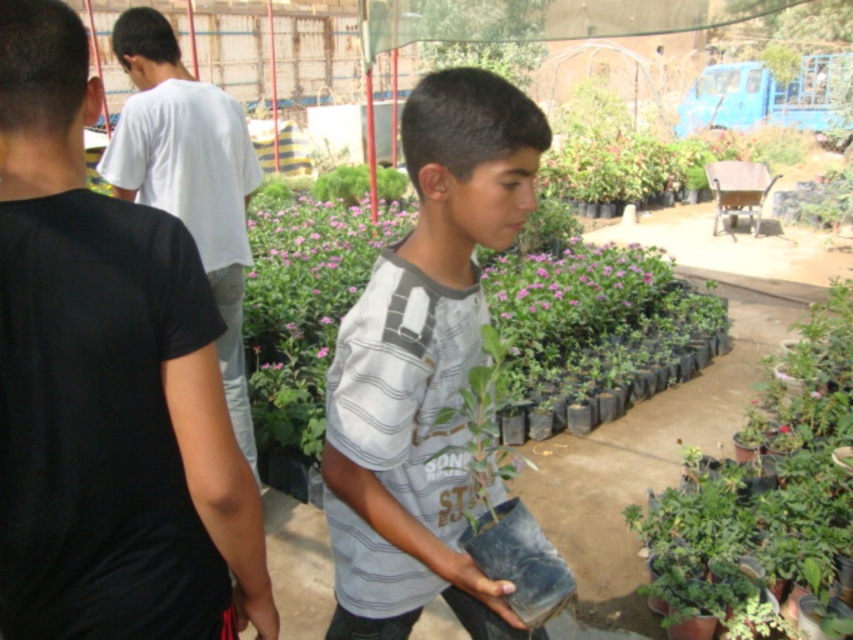
Question: Is gray striped shirt at center bigger than pink matte flowers at center?

Choices:
 (A) yes
 (B) no

Answer: (B)

Question: Among these points, which one is farthest from the camera?

Choices:
 (A) (688, 493)
 (B) (112, 132)
 (C) (22, 461)
 (D) (366, 477)

Answer: (B)

Question: Can you confirm if pink matte flowers at center is positioned below pink matte flower at center?

Choices:
 (A) no
 (B) yes

Answer: (A)

Question: Which point is farther to the camera?

Choices:
 (A) pink matte flower at center
 (B) black cotton shirt at center
 (C) pink matte flowers at center
 (D) green matte plant at center-right

Answer: (C)

Question: Which object is farther from the camera taking this photo?

Choices:
 (A) black cotton shirt at center
 (B) green matte plant at center-right
 (C) pink matte flowers at center
 (D) gray striped shirt at center

Answer: (C)

Question: Does gray striped shirt at center have a larger size compared to pink matte flower at center?

Choices:
 (A) no
 (B) yes

Answer: (B)